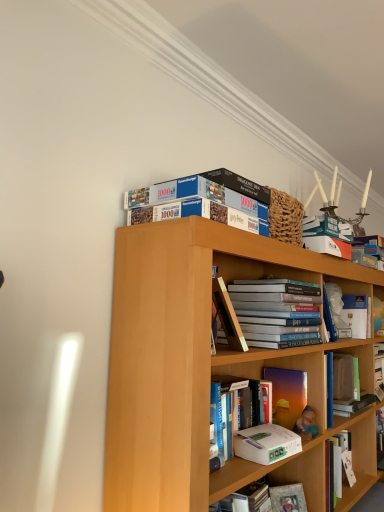
Question: Considering the relative positions of matte purple book at center, which is counted as the fifth book, starting from the left, and hardcover book at center, arranged as the 5th book when viewed from the right, in the image provided, is matte purple book at center, which is counted as the fifth book, starting from the left, to the right of hardcover book at center, arranged as the 5th book when viewed from the right, from the viewer's perspective?

Choices:
 (A) yes
 (B) no

Answer: (A)

Question: Can you confirm if matte purple book at center, which is counted as the fifth book, starting from the left, is positioned to the left of hardcover book at center, arranged as the 5th book when viewed from the right?

Choices:
 (A) no
 (B) yes

Answer: (A)

Question: Would you say hardcover book at center, which ranks as the 2th book in left-to-right order, is part of matte purple book at center, which appears as the second book when viewed from the right,'s contents?

Choices:
 (A) no
 (B) yes

Answer: (A)

Question: Can you confirm if matte purple book at center, which is counted as the fifth book, starting from the left, is bigger than hardcover book at center, which ranks as the 2th book in left-to-right order?

Choices:
 (A) yes
 (B) no

Answer: (B)

Question: Considering the relative sizes of matte purple book at center, which is counted as the fifth book, starting from the left, and hardcover book at center, arranged as the 5th book when viewed from the right, in the image provided, is matte purple book at center, which is counted as the fifth book, starting from the left, wider than hardcover book at center, arranged as the 5th book when viewed from the right,?

Choices:
 (A) yes
 (B) no

Answer: (A)

Question: Can you confirm if matte purple book at center, which is counted as the fifth book, starting from the left, is smaller than hardcover book at center, which ranks as the 2th book in left-to-right order?

Choices:
 (A) no
 (B) yes

Answer: (B)

Question: Is white matte book at center-right, which appears as the first book when viewed from the right, at the back of hardcover book at center, which is the fourth book from right to left?

Choices:
 (A) yes
 (B) no

Answer: (B)

Question: Could white matte book at center-right, which appears as the first book when viewed from the right, be considered to be inside hardcover book at center, which is the fourth book from right to left?

Choices:
 (A) no
 (B) yes

Answer: (A)

Question: Is hardcover book at center, positioned as the 3th book in left-to-right order, smaller than white matte book at center-right, which appears as the first book when viewed from the right?

Choices:
 (A) no
 (B) yes

Answer: (A)

Question: Are hardcover book at center, positioned as the 3th book in left-to-right order, and white matte book at center-right, marked as the 6th book in a left-to-right arrangement, far apart?

Choices:
 (A) yes
 (B) no

Answer: (B)

Question: Considering the relative positions of hardcover book at center, positioned as the 3th book in left-to-right order, and white matte book at center-right, marked as the 6th book in a left-to-right arrangement, in the image provided, is hardcover book at center, positioned as the 3th book in left-to-right order, to the left of white matte book at center-right, marked as the 6th book in a left-to-right arrangement, from the viewer's perspective?

Choices:
 (A) no
 (B) yes

Answer: (B)

Question: From the image's perspective, does hardcover book at center, which is the fourth book from right to left, appear lower than white matte book at center-right, marked as the 6th book in a left-to-right arrangement?

Choices:
 (A) no
 (B) yes

Answer: (B)

Question: From a real-world perspective, is white matte paperback book at center, the 1th paperback book viewed from the front, positioned under matte purple book at center, which appears as the second book when viewed from the right, based on gravity?

Choices:
 (A) no
 (B) yes

Answer: (B)